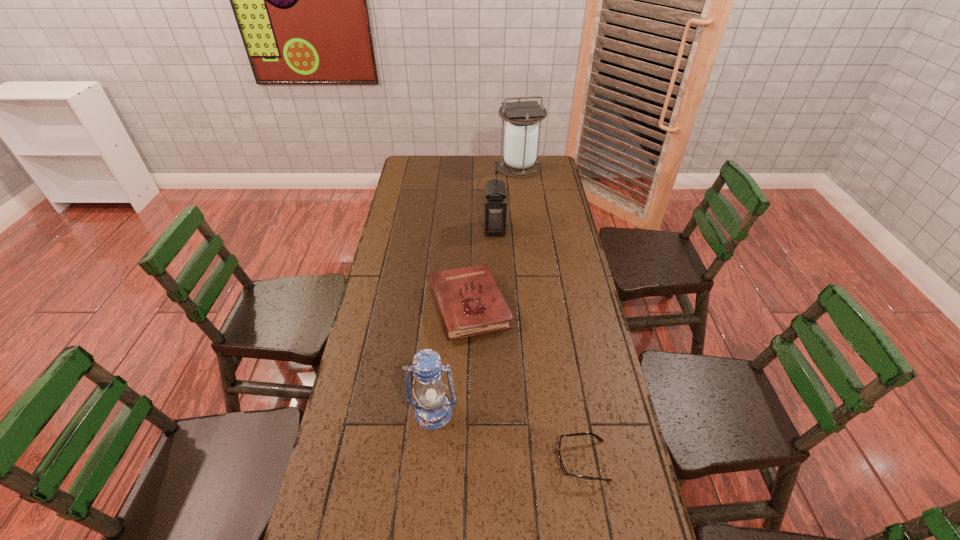
Locate an element on the screen. This screenshot has width=960, height=540. the tallest lantern is located at coordinates (521, 132).

Find the location of a particular element. the tallest object is located at coordinates (521, 132).

You are a GUI agent. You are given a task and a screenshot of the screen. Output one action in this format:
    pyautogui.click(x=<x>, y=<y>)
    Task: Click on the second farthest lantern
    This screenshot has width=960, height=540.
    Given the screenshot: What is the action you would take?
    pyautogui.click(x=495, y=206)

In order to click on the leftmost lantern in this screenshot , I will do `click(433, 411)`.

The image size is (960, 540). Identify the location of the fourth farthest object. (433, 411).

At what (x,y) coordinates should I click in order to perform the action: click on hardback book. Please return your answer as a coordinate pair (x, y). This screenshot has width=960, height=540. Looking at the image, I should click on (470, 302).

Identify the location of the fourth tallest object. The height and width of the screenshot is (540, 960). (470, 302).

Image resolution: width=960 pixels, height=540 pixels. Find the location of `the shortest object`. the shortest object is located at coordinates (585, 433).

Locate an element on the screen. spectacles is located at coordinates (585, 433).

In order to click on vacant space situated on the right of the tallest lantern in this screenshot , I will do `click(551, 167)`.